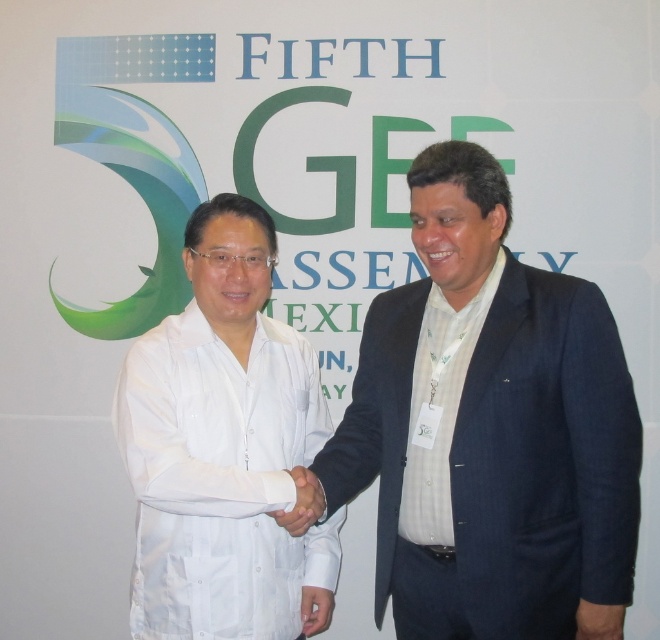
Is point (310, 362) closer to viewer compared to point (288, 474)?

No, (310, 362) is further to viewer.

The height and width of the screenshot is (640, 660). Find the location of `white matte shirt at center`. white matte shirt at center is located at coordinates (222, 449).

Describe the element at coordinates (490, 432) in the screenshot. I see `dark blue suit at center` at that location.

Between point (500, 304) and point (273, 330), which one is positioned in front?

Point (500, 304)

Between point (426, 625) and point (178, 465), which one is positioned in front?

Positioned in front is point (178, 465).

You are a GUI agent. You are given a task and a screenshot of the screen. Output one action in this format:
    pyautogui.click(x=<x>, y=<y>)
    Task: Click on the dark blue suit at center
    Image resolution: width=660 pixels, height=640 pixels.
    Given the screenshot: What is the action you would take?
    pyautogui.click(x=490, y=432)

Consider the image. Who is shorter, dark blue suit at center or white matte hand at center?

With less height is white matte hand at center.

Does dark blue suit at center have a larger size compared to white matte hand at center?

Yes.

Which is in front, point (531, 301) or point (312, 506)?

Point (312, 506) is more forward.

This screenshot has width=660, height=640. Identify the location of dark blue suit at center. (490, 432).